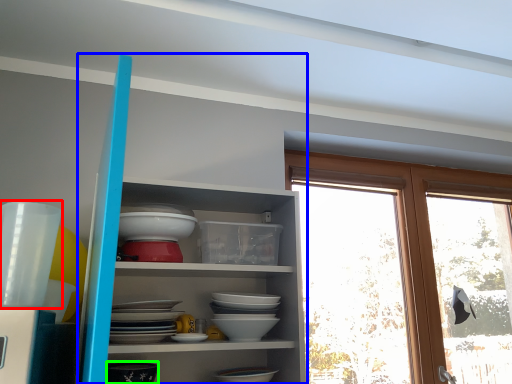
Question: Based on their relative distances, which object is farther from tableware (highlighted by a red box)? Choose from shelf (highlighted by a blue box) and tableware (highlighted by a green box).

Choices:
 (A) shelf
 (B) tableware

Answer: (A)